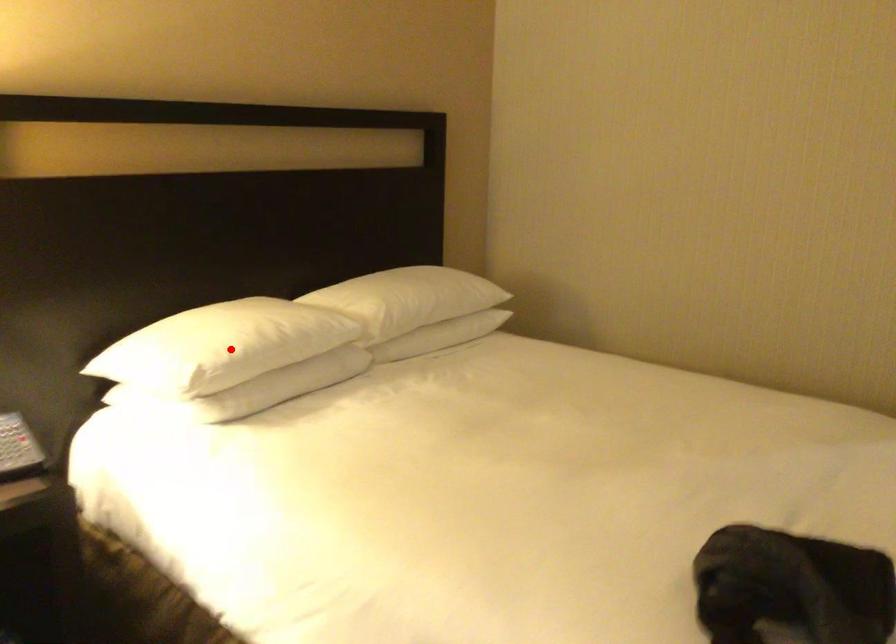
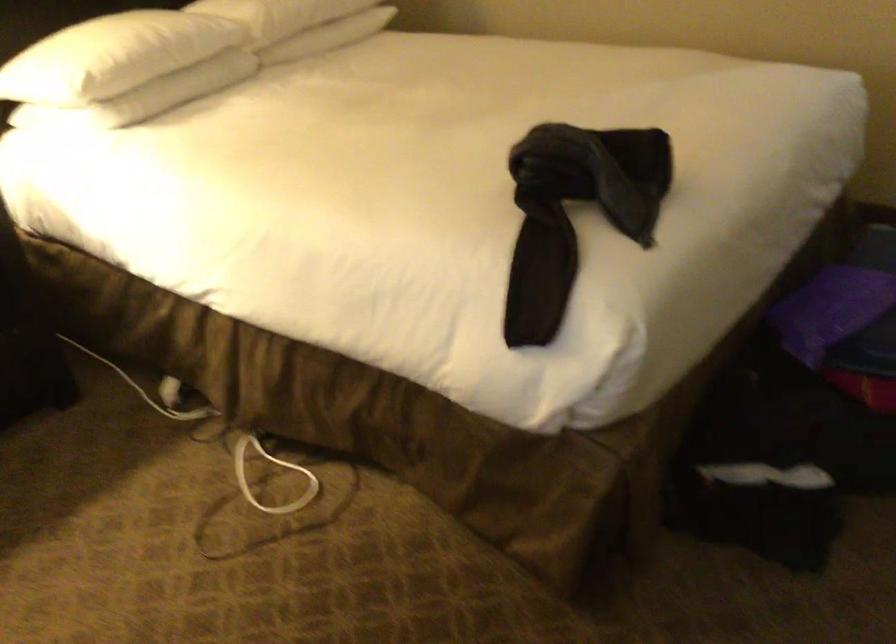
The point at the highlighted location is marked in the first image. Where is the corresponding point in the second image?

(112, 57)